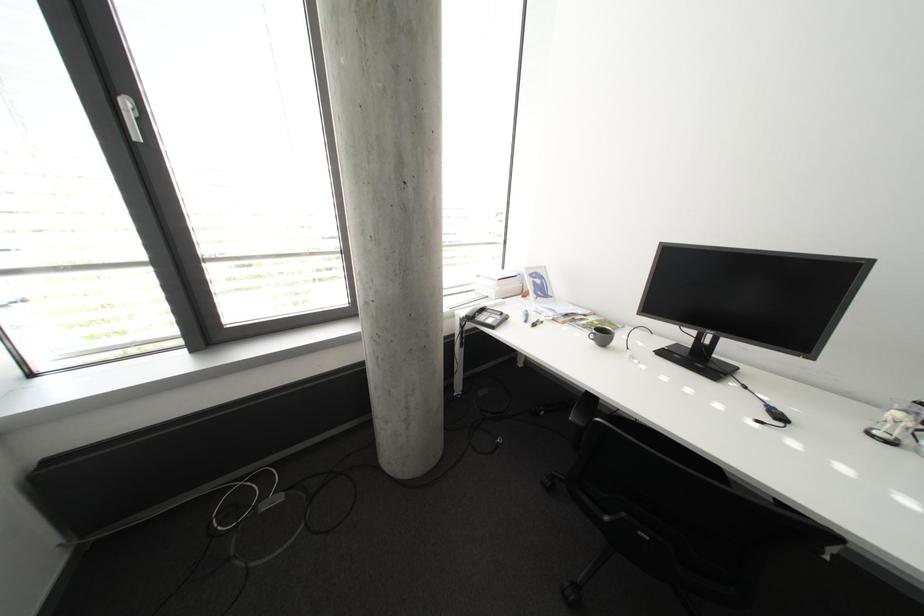
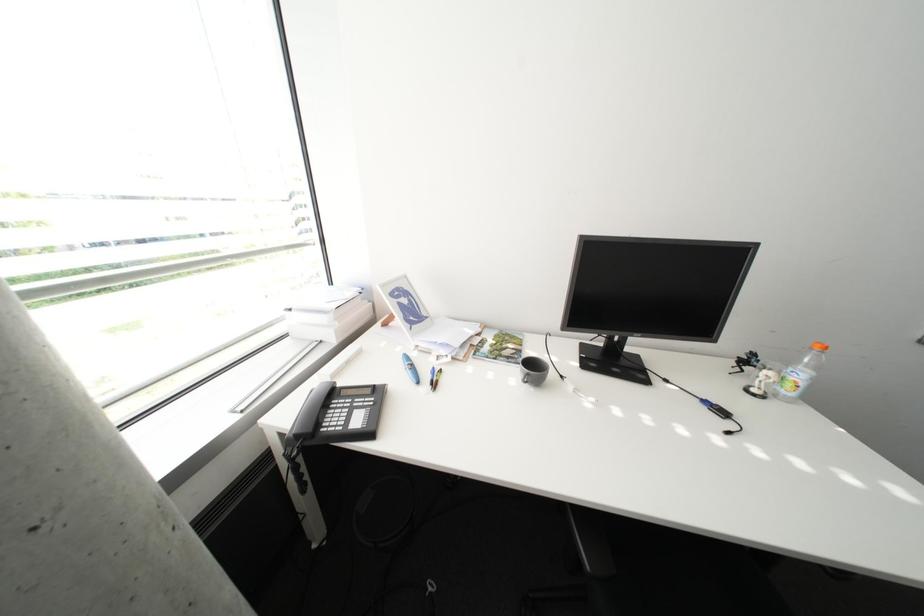
Question: The camera is either moving clockwise (left) or counter-clockwise (right) around the object. The first image is from the beginning of the video and the second image is from the end. Is the camera moving left or right when shooting the video?

Choices:
 (A) Left
 (B) Right

Answer: (A)